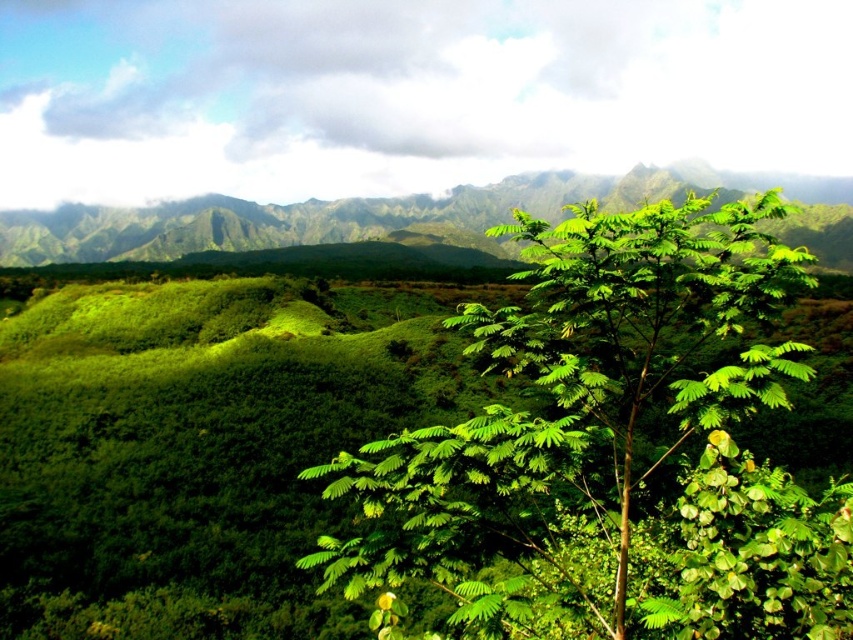
You are standing in the lush landscape and want to walk from the green leafy tree at center to the green leafy vegetation at center. Which direction should you face to move directly towards your destination?

You should face to the left because the green leafy tree at center is positioned to the right of the green leafy vegetation at center, so moving left will take you directly towards the vegetation.

You are a hiker standing at the base of the green leafy tree at center. You want to reach the green leafy vegetation at center. Which direction should you move to get there?

The green leafy tree at center is below the green leafy vegetation at center, so you should move upward to reach the green leafy vegetation at center.